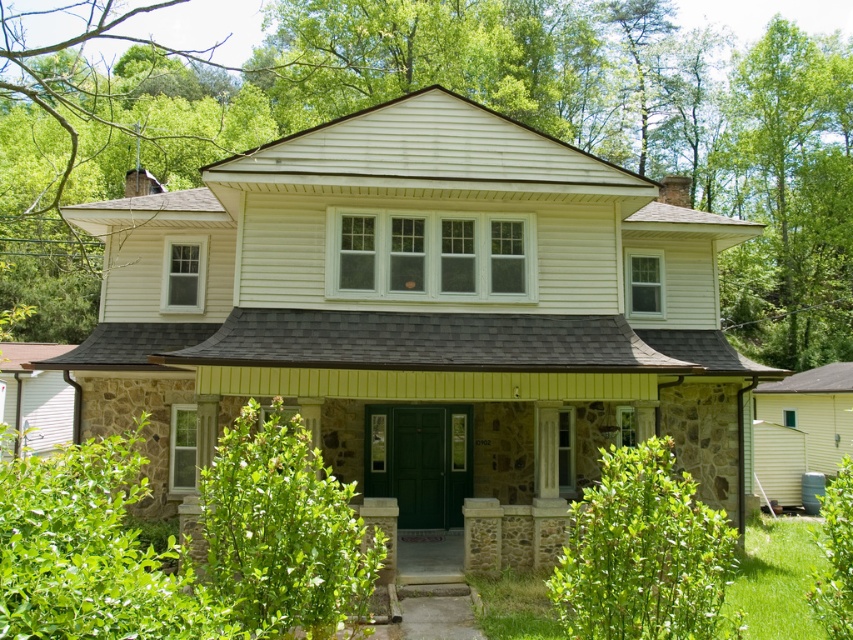
You are a landscape architect designing a garden for this house. You need to place a new bench between the green leafy tree at upper center and the green leafy tree at upper right. Considering their sizes, which tree should the bench be closer to for better balance?

The bench should be closer to the green leafy tree at upper right because the tree at upper center is wider, so placing the bench closer to the smaller tree balances the visual weight between them.